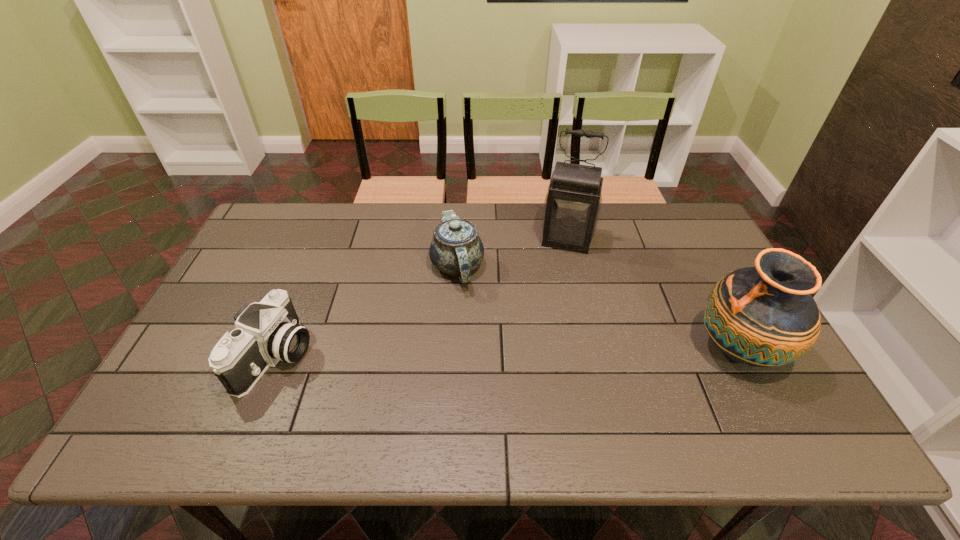
Image resolution: width=960 pixels, height=540 pixels. What are the coordinates of `empty space that is in between the chinaware and the tallest object` in the screenshot? It's located at (513, 253).

Image resolution: width=960 pixels, height=540 pixels. In order to click on empty location between the chinaware and the second tallest object in this screenshot , I will do `click(597, 308)`.

Identify the location of vacant area between the second object from left to right and the leftmost object. The height and width of the screenshot is (540, 960). (367, 311).

Locate an element on the screen. This screenshot has height=540, width=960. vacant space that is in between the third object from left to right and the chinaware is located at coordinates (513, 253).

Where is `free space between the third shortest object and the tallest object`? Image resolution: width=960 pixels, height=540 pixels. free space between the third shortest object and the tallest object is located at coordinates (653, 295).

You are a GUI agent. You are given a task and a screenshot of the screen. Output one action in this format:
    pyautogui.click(x=<x>, y=<y>)
    Task: Click on the empty space between the second tallest object and the leftmost object
    Image resolution: width=960 pixels, height=540 pixels.
    Given the screenshot: What is the action you would take?
    pyautogui.click(x=507, y=353)

Identify which object is located as the second nearest to the rightmost object. Please provide its 2D coordinates. Your answer should be formatted as a tuple, i.e. [(x, y)], where the tuple contains the x and y coordinates of a point satisfying the conditions above.

[(456, 249)]

The width and height of the screenshot is (960, 540). Identify the location of object that stands as the third closest to the leftmost object. (763, 316).

Identify the location of free point that satisfies the following two spatial constraints: 1. on the back side of the second object from right to left; 2. on the right side of the third object from right to left. Image resolution: width=960 pixels, height=540 pixels. (459, 240).

This screenshot has width=960, height=540. Find the location of `free space that satisfies the following two spatial constraints: 1. on the back side of the camera; 2. on the right side of the lantern`. free space that satisfies the following two spatial constraints: 1. on the back side of the camera; 2. on the right side of the lantern is located at coordinates (324, 240).